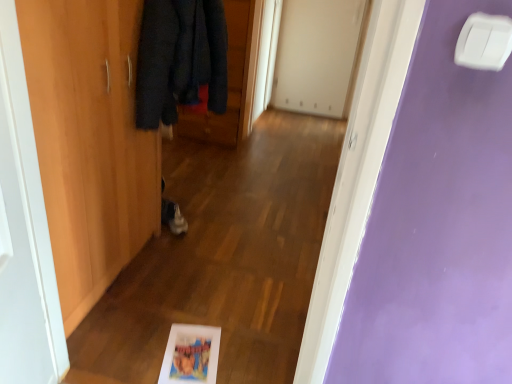
Question: In terms of height, does matte plastic picture frame at lower center look taller or shorter compared to dark blue woolen coat at upper left?

Choices:
 (A) tall
 (B) short

Answer: (B)

Question: From the image's perspective, is matte plastic picture frame at lower center positioned above or below dark blue woolen coat at upper left?

Choices:
 (A) above
 (B) below

Answer: (B)

Question: Estimate the real-world distances between objects in this image. Which object is closer to the matte plastic picture frame at lower center?

Choices:
 (A) wooden wardrobe at left, the second door when ordered from back to front
 (B) white wood door at left, positioned as the third door in back-to-front order
 (C) white matte door at upper center, which ranks as the 3th door in left-to-right order
 (D) dark blue woolen coat at upper left
 (E) white plastic light switch at upper right

Answer: (B)

Question: Which of these objects is positioned closest to the matte plastic picture frame at lower center?

Choices:
 (A) wooden wardrobe at left, the second door when ordered from back to front
 (B) dark blue woolen coat at upper left
 (C) white wood door at left, positioned as the third door in back-to-front order
 (D) white matte door at upper center, the third door viewed from the front
 (E) white plastic light switch at upper right

Answer: (C)